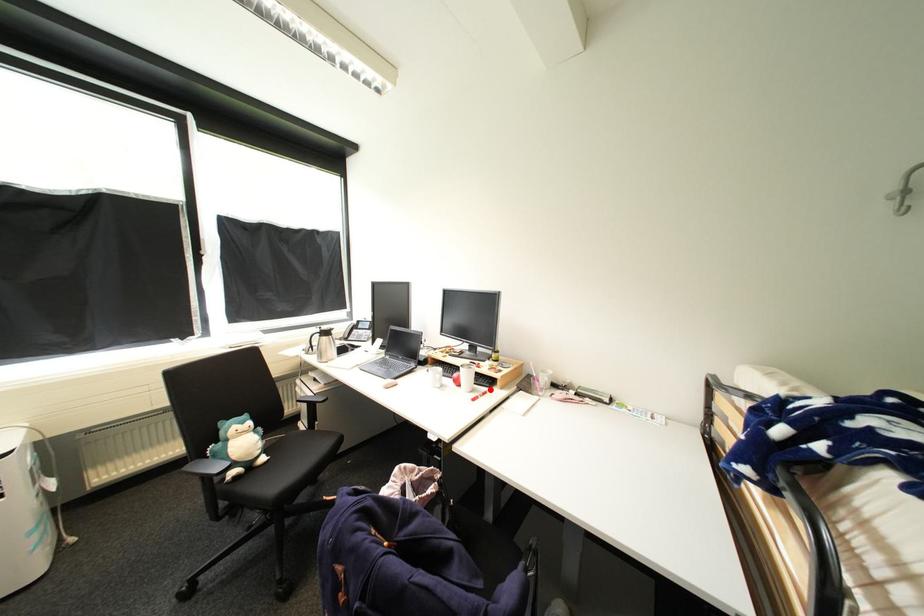
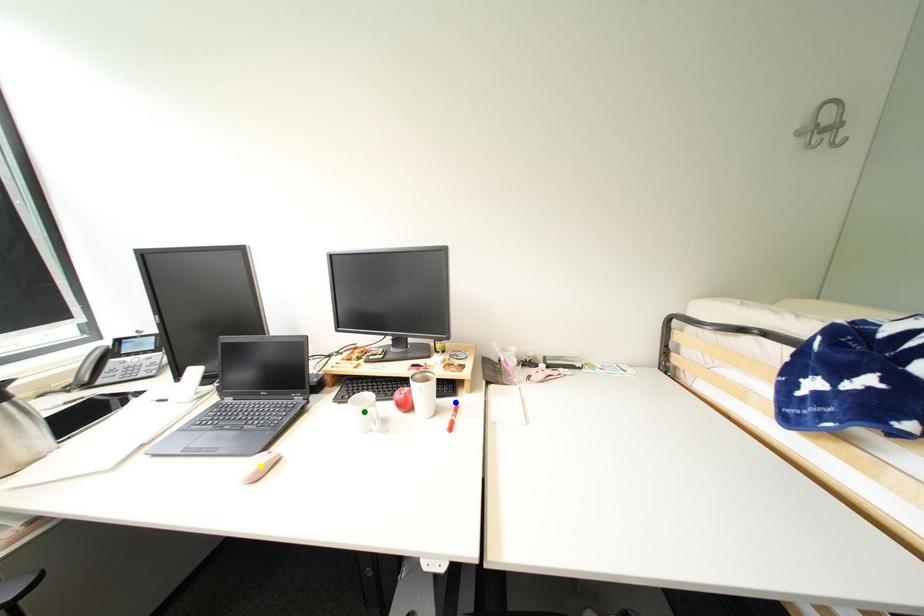
Question: I am providing you with two images of the same scene from different viewpoints. A red point is marked on the first image. You are given multiple points on the second image. Which spot in image 2 lines up with the point in image 1?

Choices:
 (A) blue point
 (B) yellow point
 (C) green point

Answer: (A)